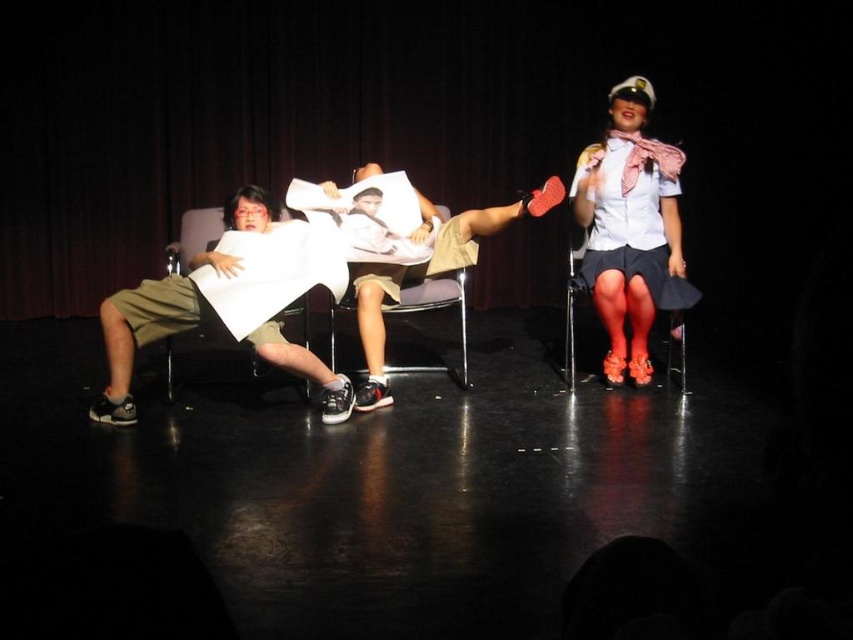
Question: Is white glossy uniform at center smaller than metallic silver chair at center?

Choices:
 (A) yes
 (B) no

Answer: (B)

Question: Which object is positioned farthest from the white glossy uniform at center?

Choices:
 (A) black leather chair at left
 (B) metallic silver chair at center

Answer: (A)

Question: Based on their relative distances, which object is farther from the white glossy uniform at center?

Choices:
 (A) khaki shorts at center
 (B) black leather chair at left

Answer: (B)

Question: Where is khaki shorts at center located in relation to black leather chair at left in the image?

Choices:
 (A) above
 (B) below

Answer: (A)

Question: Is khaki shorts at center to the left of black leather chair at left from the viewer's perspective?

Choices:
 (A) no
 (B) yes

Answer: (A)

Question: Among these objects, which one is nearest to the camera?

Choices:
 (A) black leather chair at left
 (B) matte khaki shorts at left
 (C) khaki shorts at center
 (D) metallic silver chair at center

Answer: (B)